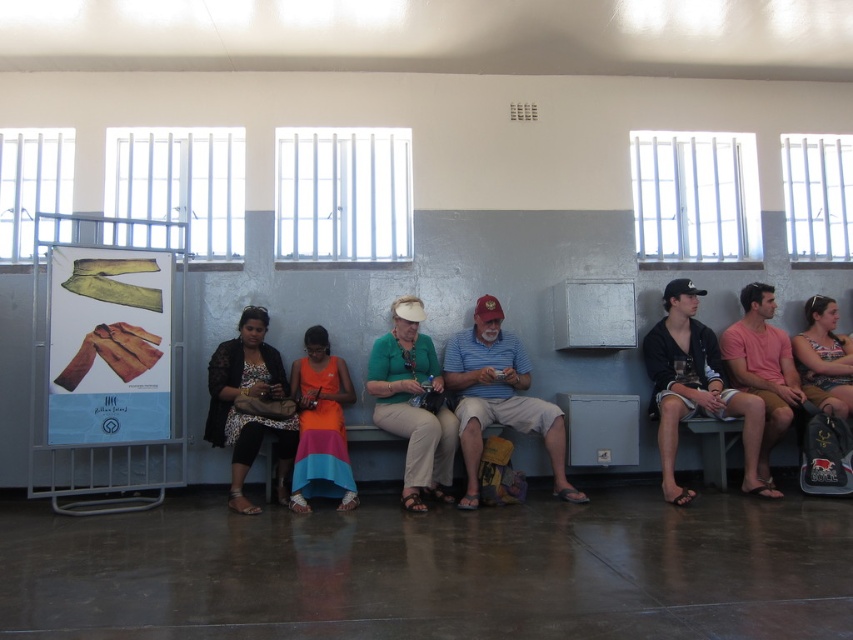
You are a tailor who needs to determine which clothing item requires more fabric to repair. You have the black cotton shorts at right and the striped cotton shirt at center. Which one needs more fabric?

The black cotton shorts at right has a larger size compared to striped cotton shirt at center, so it requires more fabric for repair.